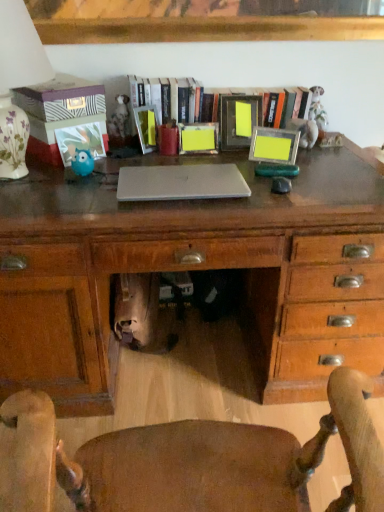
Locate an element on the screen. free space in front of matte blue owl at left, which is the 1th picture frame from left to right is located at coordinates (92, 181).